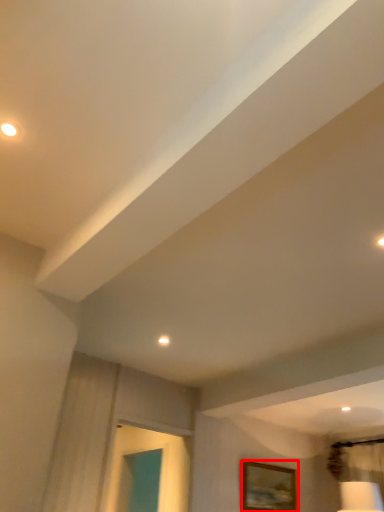
Question: From the image's perspective, what is the correct spatial relationship of picture frame (annotated by the red box) in relation to droplight?

Choices:
 (A) below
 (B) above

Answer: (A)